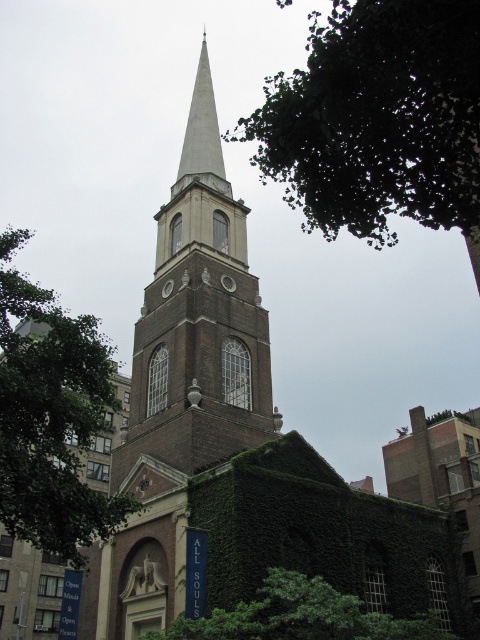
You are standing in front of the historic church and want to determine the relative positions of two points marked on its facade. The first point is located at coordinates point (365,28), and the second at point (253,352). Which point is positioned closer to you?

Point (365,28) is closer to the viewer than point (253,352).